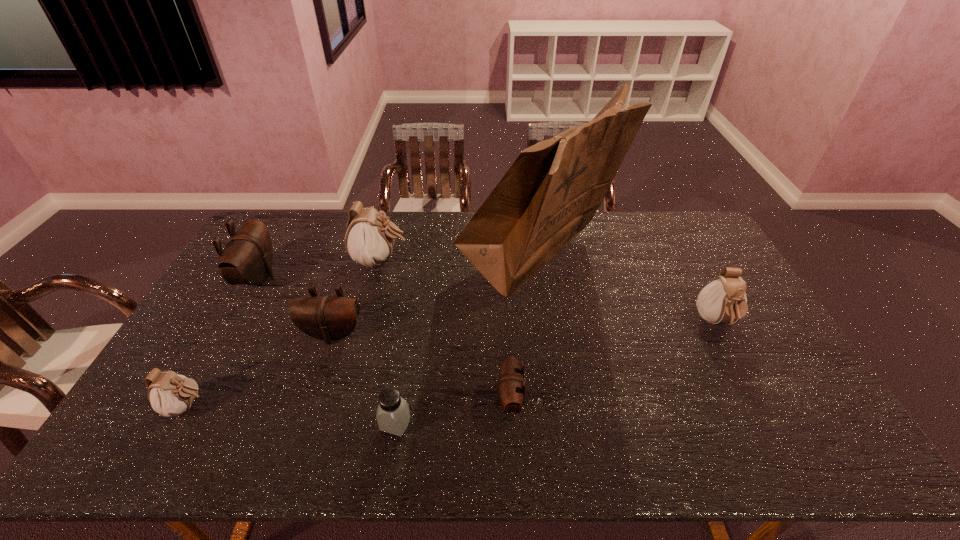
Find the location of a particular element. This screenshot has height=540, width=960. free region at the near edge is located at coordinates (643, 443).

Image resolution: width=960 pixels, height=540 pixels. Find the location of `free space at the right edge`. free space at the right edge is located at coordinates (764, 329).

What are the coordinates of `vacant space at the far left corner of the desktop` in the screenshot? It's located at (272, 241).

Where is `vacant space at the near right corner`? Image resolution: width=960 pixels, height=540 pixels. vacant space at the near right corner is located at coordinates (813, 457).

You are a GUI agent. You are given a task and a screenshot of the screen. Output one action in this format:
    pyautogui.click(x=<x>, y=<y>)
    Task: Click on the empty space that is in between the grocery bag and the second brown pouch from right to left
    The width and height of the screenshot is (960, 540).
    Given the screenshot: What is the action you would take?
    pyautogui.click(x=433, y=299)

Identify the location of free space between the rightmost object and the nearest white pouch. (452, 364).

The image size is (960, 540). I want to click on vacant area that lies between the smallest white pouch and the rightmost pouch, so click(452, 364).

Locate an element on the screen. The image size is (960, 540). free space between the biggest white pouch and the leftmost brown pouch is located at coordinates (320, 269).

This screenshot has width=960, height=540. Find the location of `free space between the second nearest white pouch and the second nearest brown pouch`. free space between the second nearest white pouch and the second nearest brown pouch is located at coordinates (524, 328).

Where is `empty space between the fourth object from right to left and the second smallest white pouch`? empty space between the fourth object from right to left and the second smallest white pouch is located at coordinates (556, 373).